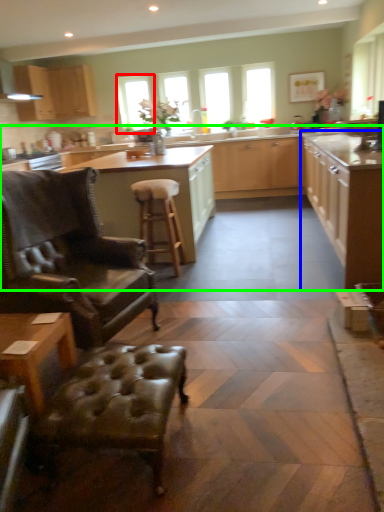
Question: Considering the real-world distances, which object is farthest from window (highlighted by a red box)? cabinetry (highlighted by a blue box) or cabinetry (highlighted by a green box)?

Choices:
 (A) cabinetry
 (B) cabinetry

Answer: (A)